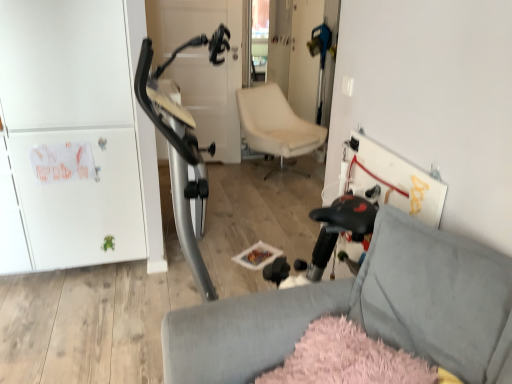
Question: In the image, is white matte cabinet at left on the left side or the right side of beige leather chair at center, which is the first chair in top-to-bottom order?

Choices:
 (A) left
 (B) right

Answer: (A)

Question: Considering the positions of white matte cabinet at left and beige leather chair at center, which is the first chair in top-to-bottom order, in the image, is white matte cabinet at left wider or thinner than beige leather chair at center, which is the first chair in top-to-bottom order,?

Choices:
 (A) wide
 (B) thin

Answer: (A)

Question: Based on their relative distances, which object is nearer to the white matte cabinet at left?

Choices:
 (A) soft gray fabric chair at lower right, which appears as the second chair when viewed from the back
 (B) beige leather chair at center, marked as the second chair in a front-to-back arrangement

Answer: (A)

Question: Considering the real-world distances, which object is farthest from the white matte cabinet at left?

Choices:
 (A) soft gray fabric chair at lower right, which appears as the second chair when viewed from the back
 (B) beige leather chair at center, which is the first chair in top-to-bottom order

Answer: (B)